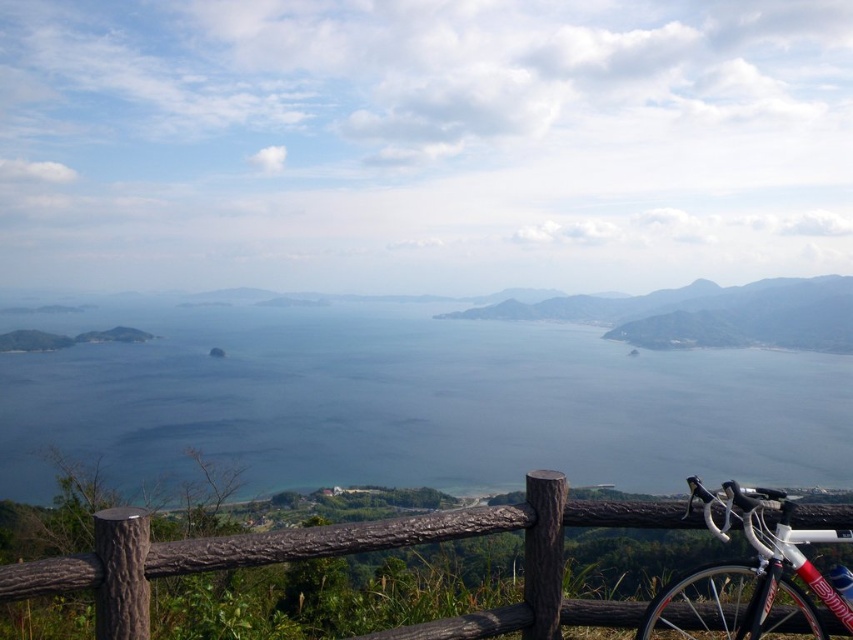
You are standing at the vantage point overlooking the scene. You see the blue water at center and the brown wooden fence at lower center. Which object is closer to you?

The brown wooden fence at lower center is closer to you because it is positioned above the blue water at center, which is located further away in the scene.

You are standing at the vantage point overlooking the ocean and islands. There is a specific point marked at coordinates point (524,561) in your field of view. You have a laser pointer that can reach up to 4 meters. Can your laser pointer reach that point?

The point (524,561) is 3.57 meters away from the viewer, so yes, the laser pointer can reach it since its range is within the 4 meters limit.